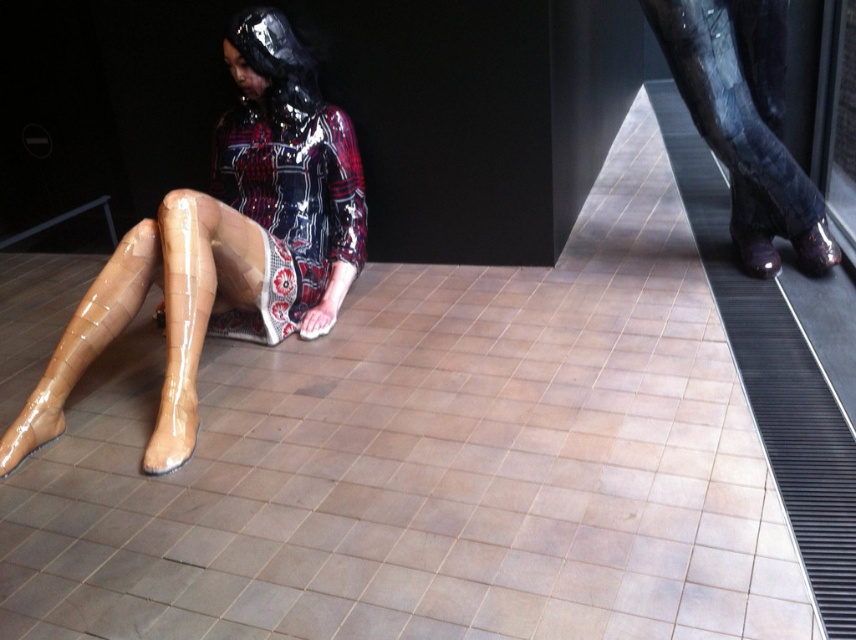
You are a fashion designer trying to create a new line of boots. You observe the glossy black boot at upper right and the glossy tan boot at lower left in the image. Which boot would you recommend to a client who wants a taller boot for a runway show?

The glossy black boot at upper right is much taller than the glossy tan boot at lower left, so it would be the better choice for a runway show requiring a taller boot.

You are a fashion designer observing the glossy black boot at upper right and the glossy tan boot at lower left. Which boot would you choose if you need to select the one with the bigger size for a runway show?

The glossy black boot at upper right has a larger size compared to the glossy tan boot at lower left, so it would be the better choice for the runway show.

You are a fashion designer observing the glossy tan boots at lower left and the glossy tan boot at lower left in the image. Which one has a larger size?

The glossy tan boots at lower left is bigger than the glossy tan boot at lower left.